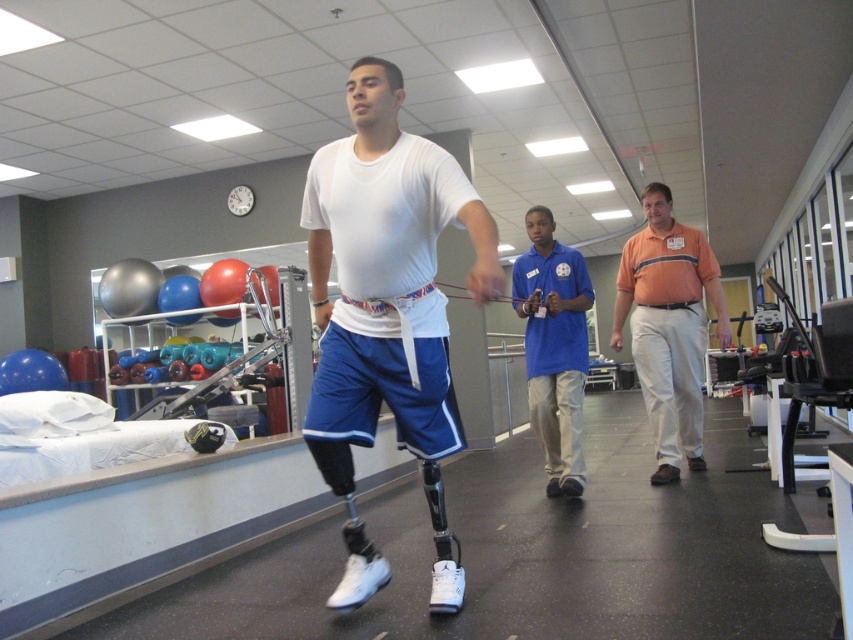
Question: Is white matte/soft fabric shirt at center further to camera compared to rubber/elastic resistance band at center?

Choices:
 (A) no
 (B) yes

Answer: (A)

Question: Does white matte/soft fabric shirt at center lie in front of blue cotton shirt at center?

Choices:
 (A) no
 (B) yes

Answer: (B)

Question: Among these objects, which one is farthest from the camera?

Choices:
 (A) blue cotton shirt at center
 (B) white matte/soft fabric shirt at center
 (C) rubber/elastic resistance band at center
 (D) orange cotton shirt at center

Answer: (C)

Question: Which point is farther to the camera?

Choices:
 (A) (641, 378)
 (B) (540, 260)
 (C) (374, 72)
 (D) (518, 300)

Answer: (A)

Question: Which object is farther from the camera taking this photo?

Choices:
 (A) orange cotton shirt at center
 (B) white matte/soft fabric shirt at center

Answer: (A)

Question: Is orange cotton shirt at center to the right of blue cotton shirt at center from the viewer's perspective?

Choices:
 (A) no
 (B) yes

Answer: (B)